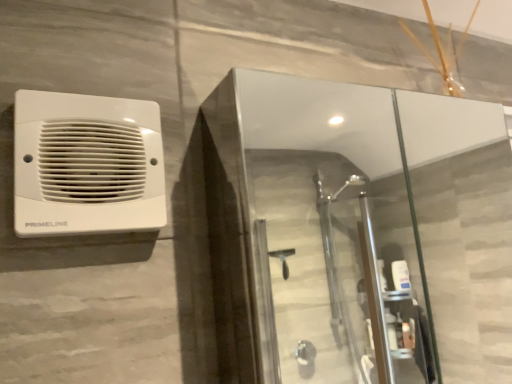
Question: Could you tell me if white plastic speaker at upper left is facing transparent glass shower door at upper center?

Choices:
 (A) yes
 (B) no

Answer: (B)

Question: Considering the relative sizes of white plastic speaker at upper left and transparent glass shower door at upper center in the image provided, is white plastic speaker at upper left shorter than transparent glass shower door at upper center?

Choices:
 (A) yes
 (B) no

Answer: (A)

Question: From a real-world perspective, is white plastic speaker at upper left located higher than transparent glass shower door at upper center?

Choices:
 (A) no
 (B) yes

Answer: (B)

Question: From a real-world perspective, is white plastic speaker at upper left located beneath transparent glass shower door at upper center?

Choices:
 (A) yes
 (B) no

Answer: (B)

Question: Can you confirm if white plastic speaker at upper left is bigger than transparent glass shower door at upper center?

Choices:
 (A) yes
 (B) no

Answer: (B)

Question: Is white plastic speaker at upper left oriented away from transparent glass shower door at upper center?

Choices:
 (A) no
 (B) yes

Answer: (A)

Question: From a real-world perspective, does transparent glass shower door at upper center sit lower than white plastic speaker at upper left?

Choices:
 (A) no
 (B) yes

Answer: (B)

Question: Is transparent glass shower door at upper center looking in the opposite direction of white plastic speaker at upper left?

Choices:
 (A) yes
 (B) no

Answer: (B)

Question: Is transparent glass shower door at upper center smaller than white plastic speaker at upper left?

Choices:
 (A) yes
 (B) no

Answer: (B)

Question: Considering the relative sizes of transparent glass shower door at upper center and white plastic speaker at upper left in the image provided, is transparent glass shower door at upper center wider than white plastic speaker at upper left?

Choices:
 (A) no
 (B) yes

Answer: (B)

Question: Is white plastic speaker at upper left inside transparent glass shower door at upper center?

Choices:
 (A) yes
 (B) no

Answer: (B)

Question: Can you confirm if transparent glass shower door at upper center is positioned to the left of white plastic speaker at upper left?

Choices:
 (A) no
 (B) yes

Answer: (A)

Question: Is transparent glass shower door at upper center to the left or to the right of white plastic speaker at upper left in the image?

Choices:
 (A) left
 (B) right

Answer: (B)